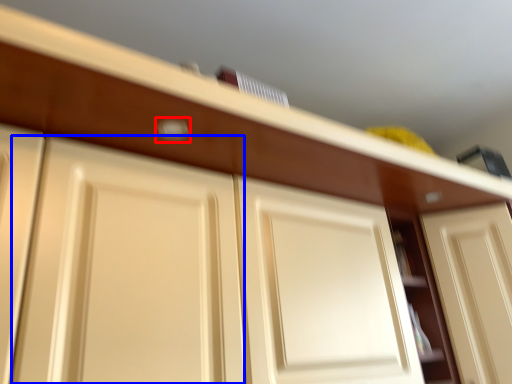
Question: Among these objects, which one is nearest to the camera, door handle (highlighted by a red box) or door (highlighted by a blue box)?

Choices:
 (A) door handle
 (B) door

Answer: (B)